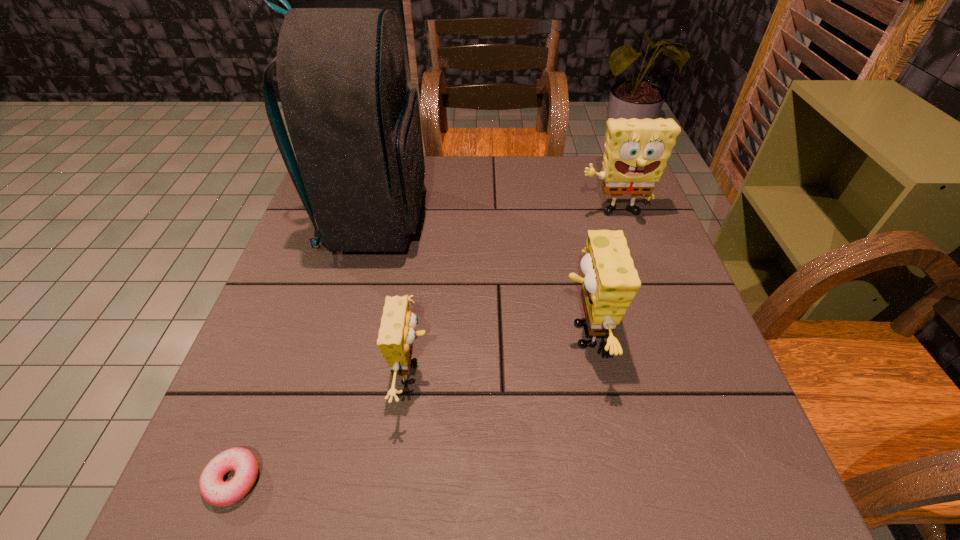
Where is `the second closest sponge to the tallest object`? the second closest sponge to the tallest object is located at coordinates (610, 281).